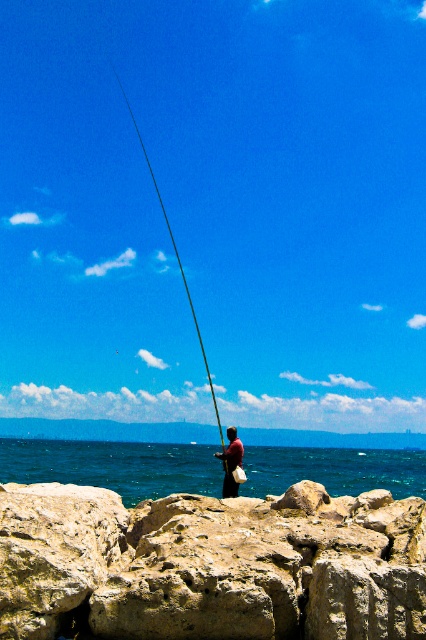
Question: Which is nearer to the brown leather bag at center?

Choices:
 (A) blue water at center
 (B) black rod fishing pole at center
 (C) rough textured rock at lower center

Answer: (C)

Question: Estimate the real-world distances between objects in this image. Which object is farther from the brown leather bag at center?

Choices:
 (A) blue water at center
 (B) black rod fishing pole at center
 (C) rough textured rock at lower center

Answer: (B)

Question: Which point is closer to the camera?

Choices:
 (A) black rod fishing pole at center
 (B) brown leather bag at center

Answer: (B)

Question: Does blue water at center have a greater width compared to black rod fishing pole at center?

Choices:
 (A) yes
 (B) no

Answer: (A)

Question: Observing the image, what is the correct spatial positioning of blue water at center in reference to brown leather bag at center?

Choices:
 (A) left
 (B) right

Answer: (B)

Question: Can you confirm if black rod fishing pole at center is positioned above brown leather bag at center?

Choices:
 (A) no
 (B) yes

Answer: (B)